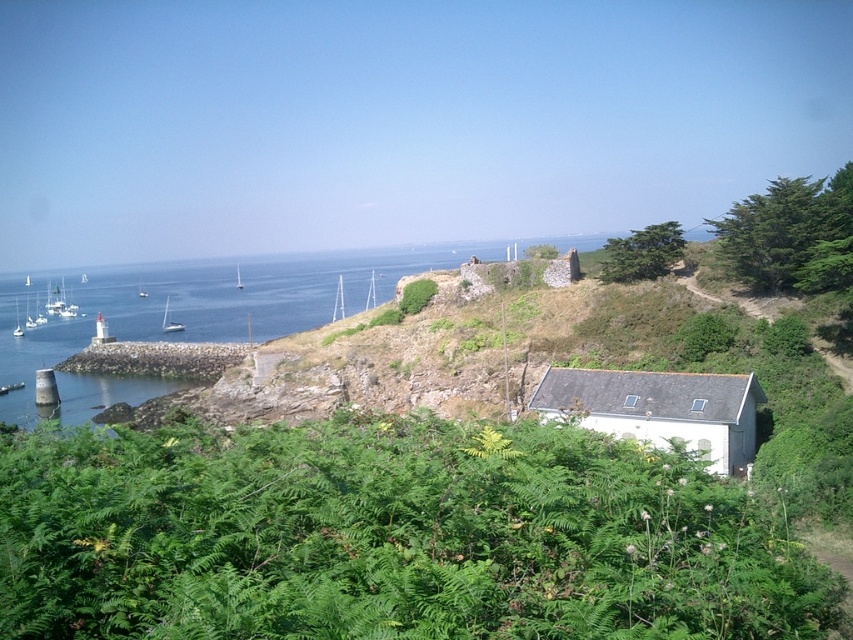
Question: Can you confirm if white matte cottage at center is wider than green leafy shrub at upper right?

Choices:
 (A) yes
 (B) no

Answer: (A)

Question: Which object is the closest to the white glossy sailboat at left?

Choices:
 (A) white plastic sailboat at center
 (B) white sailboat at left

Answer: (A)

Question: Can you confirm if white matte cottage at center is wider than green leafy shrub at upper right?

Choices:
 (A) no
 (B) yes

Answer: (B)

Question: Which point is farther from the camera taking this photo?

Choices:
 (A) (177, 324)
 (B) (654, 252)

Answer: (A)

Question: Among these objects, which one is farthest from the camera?

Choices:
 (A) white plastic sailboat at center
 (B) white sailboat at left
 (C) white sailboat at center

Answer: (B)

Question: In this image, where is white plastic sailboat at center located relative to white glossy sailboat at left?

Choices:
 (A) left
 (B) right

Answer: (B)